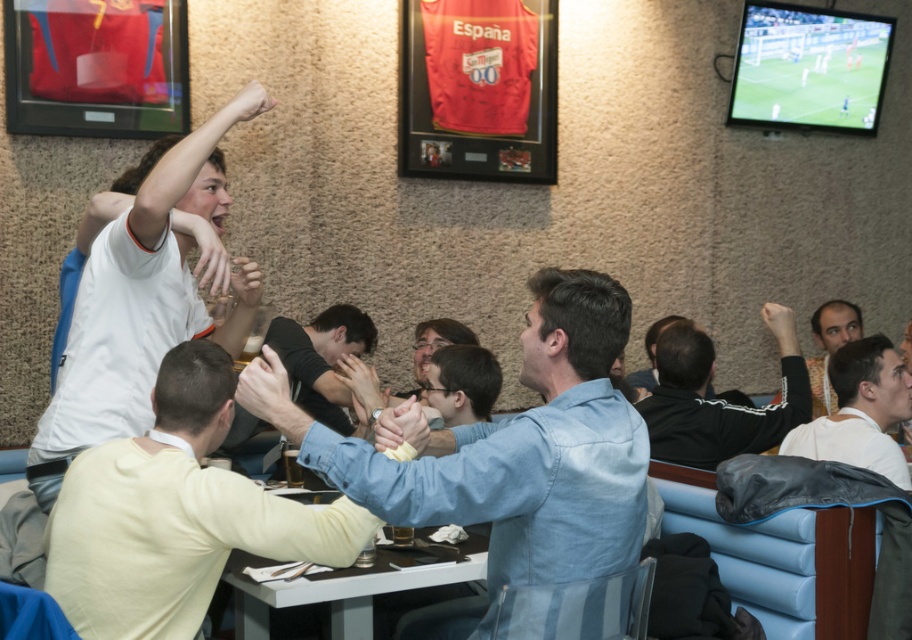
You are a photographer taking a picture of the scene. You notice the white matte shirt at upper left and the patterned fabric shirt at right. Which shirt is closer to the camera?

The white matte shirt at upper left is closer to the camera because it is in front of the patterned fabric shirt at right.